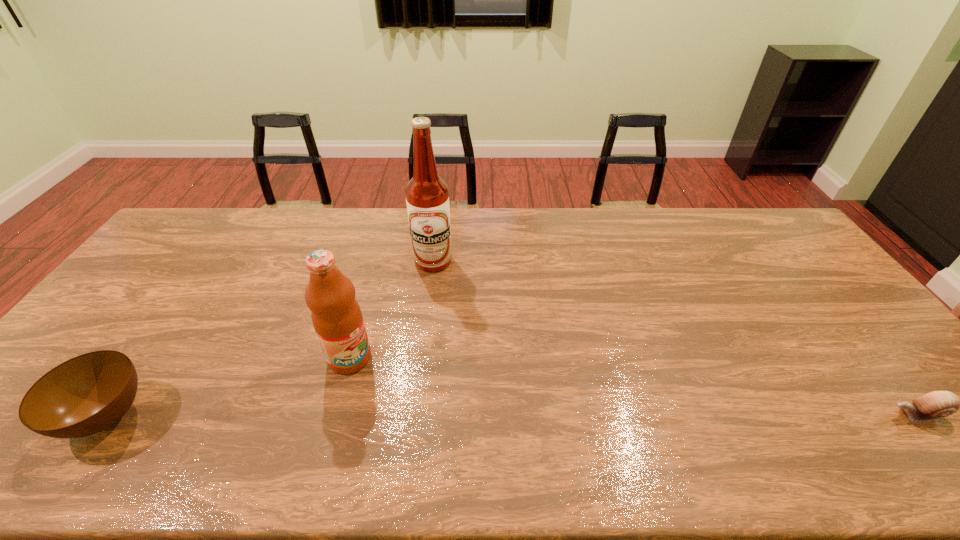
At what (x,y) coordinates should I click in order to perform the action: click on free region located 0.400m on the front-facing side of the shortest object. Please return your answer as a coordinate pair (x, y). Looking at the image, I should click on (719, 414).

Locate an element on the screen. vacant space located on the front-facing side of the shortest object is located at coordinates (790, 414).

Find the location of a particular element. The image size is (960, 540). vacant space located 0.180m on the label side of the farthest object is located at coordinates (456, 311).

Find the location of a particular element. vacant space located 0.210m on the label side of the farthest object is located at coordinates (459, 318).

This screenshot has height=540, width=960. In order to click on free space located on the label side of the farthest object in this screenshot , I will do `click(465, 330)`.

The height and width of the screenshot is (540, 960). Find the location of `vacant area located 0.110m on the front label of the second object from left to right`. vacant area located 0.110m on the front label of the second object from left to right is located at coordinates click(390, 395).

You are a GUI agent. You are given a task and a screenshot of the screen. Output one action in this format:
    pyautogui.click(x=<x>, y=<y>)
    Task: Click on the free space located on the front label of the second object from left to right
    This screenshot has height=540, width=960.
    Given the screenshot: What is the action you would take?
    pyautogui.click(x=412, y=414)

Find the location of a particular element. Image resolution: width=960 pixels, height=540 pixels. bowl that is at the near edge is located at coordinates (82, 396).

Find the location of a particular element. This screenshot has width=960, height=540. escargot at the near edge is located at coordinates (936, 404).

Where is `object present at the left edge`? object present at the left edge is located at coordinates (82, 396).